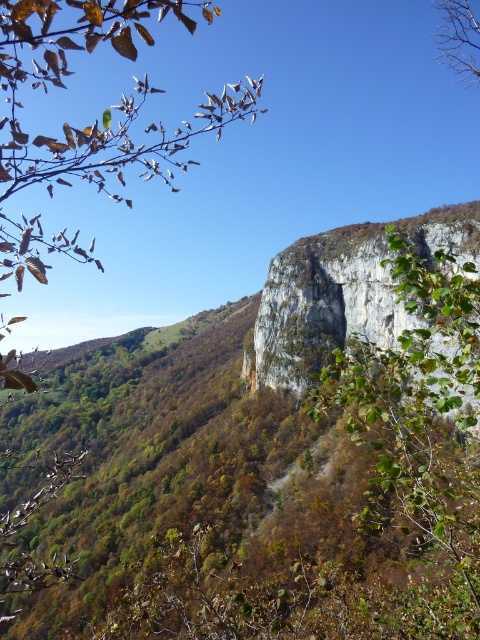
Between green leafy branch at upper left and green leafy tree at upper right, which one has less height?

With less height is green leafy tree at upper right.

Is green leafy branch at upper left to the right of green leafy tree at upper right from the viewer's perspective?

Incorrect, green leafy branch at upper left is not on the right side of green leafy tree at upper right.

Does point (203, 13) come behind point (462, 40)?

Yes.

This screenshot has width=480, height=640. Find the location of `green leafy branch at upper left`. green leafy branch at upper left is located at coordinates (105, 108).

Can you confirm if green leafy branch at upper left is bigger than gray rough rock face at upper center?

Yes.

Between green leafy branch at upper left and gray rough rock face at upper center, which one has more height?

green leafy branch at upper left is taller.

Where is `green leafy branch at upper left`? green leafy branch at upper left is located at coordinates (105, 108).

Who is more distant from viewer, (370, 337) or (468, 6)?

Positioned behind is point (468, 6).

Is gray rough rock face at upper center smaller than green leafy tree at upper right?

Correct, gray rough rock face at upper center occupies less space than green leafy tree at upper right.

Is point (405, 227) more distant than point (476, 80)?

No, it is not.

Locate an element on the screen. gray rough rock face at upper center is located at coordinates (324, 304).